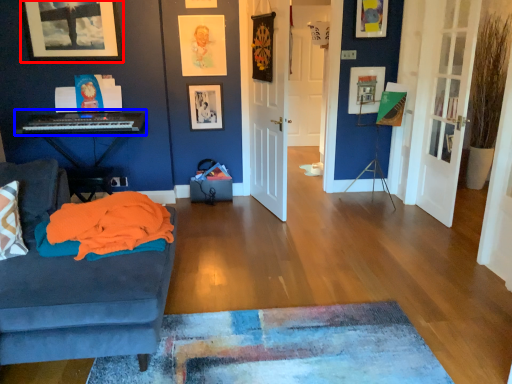
Question: Which of the following is the closest to the observer, picture frame (highlighted by a red box) or musical keyboard (highlighted by a blue box)?

Choices:
 (A) picture frame
 (B) musical keyboard

Answer: (B)